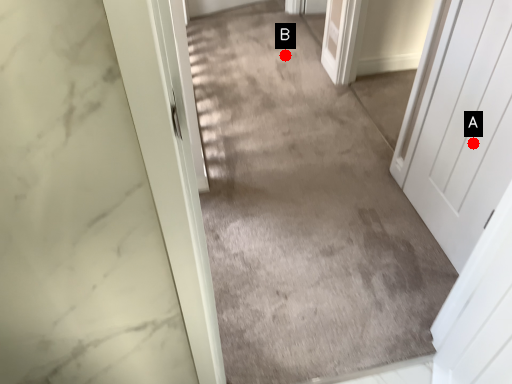
Question: Two points are circled on the image, labeled by A and B beside each circle. Among these points, which one is nearest to the camera?

Choices:
 (A) A is closer
 (B) B is closer

Answer: (A)